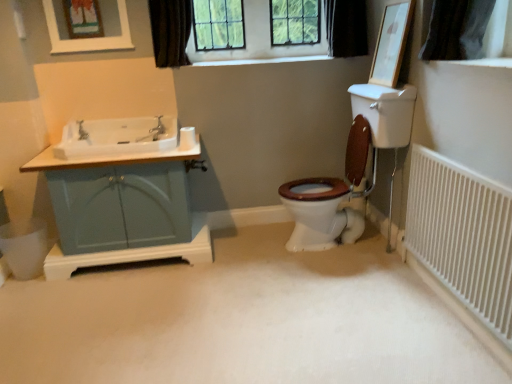
Question: Looking at their shapes, would you say black fabric curtain at upper center, acting as the 1th curtain starting from the right, is wider or thinner than wooden picture frame at upper right, which is counted as the second picture frame, starting from the left?

Choices:
 (A) wide
 (B) thin

Answer: (A)

Question: Would you say black fabric curtain at upper center, the 2th curtain in the left-to-right sequence, is to the left or to the right of wooden picture frame at upper right, which ranks as the first picture frame in right-to-left order, in the picture?

Choices:
 (A) right
 (B) left

Answer: (B)

Question: Estimate the real-world distances between objects in this image. Which object is farther from the white metal radiator at lower right?

Choices:
 (A) dark fabric curtain at upper center, the second curtain positioned from the right
 (B) wooden picture frame at upper right, which ranks as the first picture frame in right-to-left order
 (C) white matte carpet at center
 (D) white glossy sink at left
 (E) white matte toilet paper at upper center

Answer: (A)

Question: Estimate the real-world distances between objects in this image. Which object is farther from the wooden framed artwork at upper left, the second picture frame positioned from the right?

Choices:
 (A) white glossy sink at left
 (B) dark fabric curtain at upper center, the first curtain in the left-to-right sequence
 (C) wooden picture frame at upper right, which ranks as the first picture frame in right-to-left order
 (D) white matte carpet at center
 (E) clear glass window at upper center

Answer: (D)